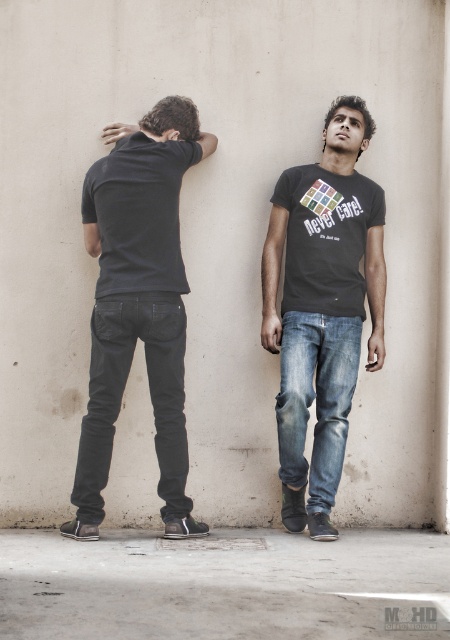
Can you confirm if black denim jeans at back is positioned above denim jeans at center?

Yes.

Which is below, black denim jeans at back or denim jeans at center?

denim jeans at center

The width and height of the screenshot is (450, 640). What are the coordinates of `black denim jeans at back` in the screenshot? It's located at (121, 396).

Is matte black polo at back wider than denim jeans at center?

Indeed, matte black polo at back has a greater width compared to denim jeans at center.

Locate an element on the screen. matte black polo at back is located at coordinates (139, 212).

Which is in front, point (85, 518) or point (107, 349)?

Point (107, 349)

At what (x,y) coordinates should I click in order to perform the action: click on matte black t-shirt at left. Please return your answer as a coordinate pair (x, y). The image size is (450, 640). Looking at the image, I should click on (139, 304).

Where is `matte black t-shirt at left`? Image resolution: width=450 pixels, height=640 pixels. matte black t-shirt at left is located at coordinates (139, 304).

Find the location of a particular element. matte black t-shirt at left is located at coordinates (139, 304).